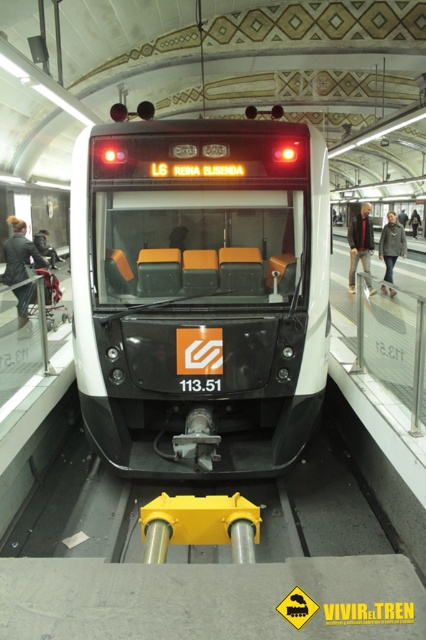
Is point (6, 276) behind point (414, 218)?

No, (6, 276) is closer to viewer.

Is leather jacket at left bigger than dark gray jacket at center?

No.

What do you see at coordinates (19, 253) in the screenshot?
I see `leather jacket at left` at bounding box center [19, 253].

At what (x,y) coordinates should I click in order to perform the action: click on leather jacket at left. Please return your answer as a coordinate pair (x, y). The height and width of the screenshot is (640, 426). Looking at the image, I should click on (19, 253).

Does dark brown leather jacket at center have a greater height compared to matte black jacket at center?

Yes.

Who is higher up, dark brown leather jacket at center or matte black jacket at center?

dark brown leather jacket at center

Which is behind, point (373, 241) or point (45, 230)?

The point (45, 230) is more distant.

This screenshot has width=426, height=640. What are the coordinates of `dark brown leather jacket at center` in the screenshot? It's located at (359, 243).

Is point (253, 241) closer to viewer compared to point (25, 266)?

That is True.

How distant is white glossy train at center from leather jacket at left?

white glossy train at center is 5.05 meters away from leather jacket at left.

Is point (313, 294) positioned before point (16, 230)?

That is True.

Locate an element on the screen. The width and height of the screenshot is (426, 640). white glossy train at center is located at coordinates (199, 292).